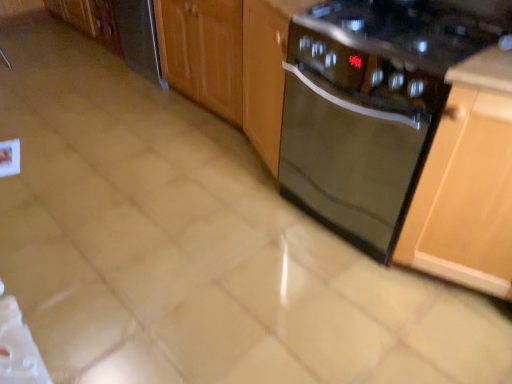
Question: From the image's perspective, is black glass gas stove at upper right over black glass dishwasher at center?

Choices:
 (A) yes
 (B) no

Answer: (A)

Question: Is black glass gas stove at upper right outside of black glass dishwasher at center?

Choices:
 (A) yes
 (B) no

Answer: (A)

Question: Is black glass gas stove at upper right closer to camera compared to black glass dishwasher at center?

Choices:
 (A) yes
 (B) no

Answer: (A)

Question: Can you confirm if black glass gas stove at upper right is thinner than black glass dishwasher at center?

Choices:
 (A) yes
 (B) no

Answer: (A)

Question: Is black glass gas stove at upper right oriented towards black glass dishwasher at center?

Choices:
 (A) no
 (B) yes

Answer: (A)

Question: From a real-world perspective, is black glass gas stove at upper right positioned under black glass dishwasher at center based on gravity?

Choices:
 (A) no
 (B) yes

Answer: (A)

Question: Can you confirm if satin stainless steel dishwasher at left is bigger than glossy wood cabinet at center, placed as the second cabinetry when sorted from right to left?

Choices:
 (A) no
 (B) yes

Answer: (A)

Question: Is the position of satin stainless steel dishwasher at left more distant than that of glossy wood cabinet at center, the second cabinetry in the bottom-to-top sequence?

Choices:
 (A) no
 (B) yes

Answer: (B)

Question: Is the position of satin stainless steel dishwasher at left less distant than that of glossy wood cabinet at center, the first cabinetry positioned from the left?

Choices:
 (A) yes
 (B) no

Answer: (B)

Question: Is satin stainless steel dishwasher at left smaller than glossy wood cabinet at center, the second cabinetry in the bottom-to-top sequence?

Choices:
 (A) yes
 (B) no

Answer: (A)

Question: Can you confirm if satin stainless steel dishwasher at left is wider than glossy wood cabinet at center, which is counted as the 2th cabinetry, starting from the front?

Choices:
 (A) no
 (B) yes

Answer: (A)

Question: Could you tell me if satin stainless steel dishwasher at left is facing glossy wood cabinet at center, the first cabinetry positioned from the left?

Choices:
 (A) no
 (B) yes

Answer: (A)

Question: Is black glass dishwasher at center taller than glossy wood cabinet at center, arranged as the 1th cabinetry when viewed from the back?

Choices:
 (A) no
 (B) yes

Answer: (B)